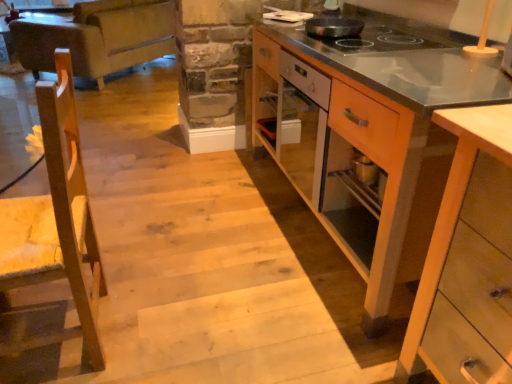
Measure the distance between wooden cabinet at right, which is the 2th cabinetry from front to back, and camera.

wooden cabinet at right, which is the 2th cabinetry from front to back, and camera are 1.02 meters apart.

Where is `light wood cabinet at lower right, the 1th cabinetry in the front-to-back sequence`? The height and width of the screenshot is (384, 512). light wood cabinet at lower right, the 1th cabinetry in the front-to-back sequence is located at coordinates (468, 259).

This screenshot has height=384, width=512. In order to click on leather couch at upper left in this screenshot , I will do `click(98, 37)`.

The width and height of the screenshot is (512, 384). Find the location of `wooden chair at left`. wooden chair at left is located at coordinates (55, 222).

What's the angular difference between wooden chair at left and black non-stick pan at upper center's facing directions?

0.001 degrees.

Which is in front, point (65, 240) or point (342, 23)?

The point (65, 240) is closer.

From a real-world perspective, is wooden chair at left located higher than black non-stick pan at upper center?

Incorrect, from a real-world perspective, wooden chair at left is lower than black non-stick pan at upper center.

Between wooden chair at left and black non-stick pan at upper center, which one is positioned in front?

wooden chair at left is closer to the camera.

Which is more to the left, wooden cabinet at right, which is the 2th cabinetry from front to back, or light wood cabinet at lower right, which ranks as the second cabinetry in back-to-front order?

From the viewer's perspective, wooden cabinet at right, which is the 2th cabinetry from front to back, appears more on the left side.

Can you confirm if wooden cabinet at right, which is the 2th cabinetry from front to back, is shorter than light wood cabinet at lower right, which ranks as the second cabinetry in back-to-front order?

No, wooden cabinet at right, which is the 2th cabinetry from front to back, is not shorter than light wood cabinet at lower right, which ranks as the second cabinetry in back-to-front order.

Does wooden cabinet at right, which is the 2th cabinetry from front to back, have a larger size compared to light wood cabinet at lower right, the 1th cabinetry in the front-to-back sequence?

Yes.

Is wooden cabinet at right, the first cabinetry viewed from the back, oriented away from light wood cabinet at lower right, which ranks as the second cabinetry in back-to-front order?

No, wooden cabinet at right, the first cabinetry viewed from the back, is not facing the opposite direction of light wood cabinet at lower right, which ranks as the second cabinetry in back-to-front order.

Is light wood cabinet at lower right, the 1th cabinetry in the front-to-back sequence, facing away from leather couch at upper left?

No, light wood cabinet at lower right, the 1th cabinetry in the front-to-back sequence, is not facing away from leather couch at upper left.

From the image's perspective, is light wood cabinet at lower right, the 1th cabinetry in the front-to-back sequence, beneath leather couch at upper left?

Correct, light wood cabinet at lower right, the 1th cabinetry in the front-to-back sequence, appears lower than leather couch at upper left in the image.

Considering the sizes of objects light wood cabinet at lower right, which ranks as the second cabinetry in back-to-front order, and leather couch at upper left in the image provided, who is smaller, light wood cabinet at lower right, which ranks as the second cabinetry in back-to-front order, or leather couch at upper left?

With smaller size is light wood cabinet at lower right, which ranks as the second cabinetry in back-to-front order.

From a real-world perspective, who is located lower, light wood cabinet at lower right, the 1th cabinetry in the front-to-back sequence, or leather couch at upper left?

light wood cabinet at lower right, the 1th cabinetry in the front-to-back sequence.

Is point (95, 277) in front of point (428, 280)?

No, (95, 277) is behind (428, 280).

Is wooden chair at left to the left of light wood cabinet at lower right, which ranks as the second cabinetry in back-to-front order, from the viewer's perspective?

Indeed, wooden chair at left is positioned on the left side of light wood cabinet at lower right, which ranks as the second cabinetry in back-to-front order.

Could you tell me if wooden chair at left is facing light wood cabinet at lower right, which ranks as the second cabinetry in back-to-front order?

No, wooden chair at left is not turned towards light wood cabinet at lower right, which ranks as the second cabinetry in back-to-front order.

Consider the image. From a real-world perspective, is wooden chair at left above or below light wood cabinet at lower right, the 1th cabinetry in the front-to-back sequence?

wooden chair at left is above light wood cabinet at lower right, the 1th cabinetry in the front-to-back sequence.

Is black non-stick pan at upper center aimed at leather couch at upper left?

No, black non-stick pan at upper center is not turned towards leather couch at upper left.

Considering the relative sizes of black non-stick pan at upper center and leather couch at upper left in the image provided, is black non-stick pan at upper center taller than leather couch at upper left?

No.

Considering the sizes of black non-stick pan at upper center and leather couch at upper left in the image, is black non-stick pan at upper center wider or thinner than leather couch at upper left?

Considering their sizes, black non-stick pan at upper center looks slimmer than leather couch at upper left.

Are black non-stick pan at upper center and leather couch at upper left far apart?

Yes, black non-stick pan at upper center and leather couch at upper left are located far from each other.

From the image's perspective, does light wood cabinet at lower right, which ranks as the second cabinetry in back-to-front order, appear lower than wooden chair at left?

Correct, light wood cabinet at lower right, which ranks as the second cabinetry in back-to-front order, appears lower than wooden chair at left in the image.

Looking at this image, measure the distance between light wood cabinet at lower right, the 1th cabinetry in the front-to-back sequence, and wooden chair at left.

The distance of light wood cabinet at lower right, the 1th cabinetry in the front-to-back sequence, from wooden chair at left is 1.04 meters.

From a real-world perspective, does light wood cabinet at lower right, which ranks as the second cabinetry in back-to-front order, sit lower than wooden chair at left?

Yes, from a real-world perspective, light wood cabinet at lower right, which ranks as the second cabinetry in back-to-front order, is under wooden chair at left.

Is black non-stick pan at upper center looking in the opposite direction of wooden chair at left?

No, black non-stick pan at upper center is not facing the opposite direction of wooden chair at left.

Is black non-stick pan at upper center to the left of wooden chair at left from the viewer's perspective?

Incorrect, black non-stick pan at upper center is not on the left side of wooden chair at left.

Is black non-stick pan at upper center touching wooden chair at left?

No, black non-stick pan at upper center is not beside wooden chair at left.

In the image, there is a black non-stick pan at upper center. Where is `chair below it (from the image's perspective)`? This screenshot has width=512, height=384. chair below it (from the image's perspective) is located at coordinates (55, 222).

Where is `cabinetry above the light wood cabinet at lower right, which ranks as the second cabinetry in back-to-front order (from a real-world perspective)`? This screenshot has height=384, width=512. cabinetry above the light wood cabinet at lower right, which ranks as the second cabinetry in back-to-front order (from a real-world perspective) is located at coordinates point(381,140).

When comparing their distances from wooden chair at left, does light wood cabinet at lower right, which ranks as the second cabinetry in back-to-front order, or leather couch at upper left seem further?

leather couch at upper left.

When comparing their distances from leather couch at upper left, does wooden cabinet at right, which is the 2th cabinetry from front to back, or wooden chair at left seem closer?

The object closer to leather couch at upper left is wooden cabinet at right, which is the 2th cabinetry from front to back.

From the image, which object appears to be nearer to light wood cabinet at lower right, which ranks as the second cabinetry in back-to-front order, wooden cabinet at right, which is the 2th cabinetry from front to back, or leather couch at upper left?

Among the two, wooden cabinet at right, which is the 2th cabinetry from front to back, is located nearer to light wood cabinet at lower right, which ranks as the second cabinetry in back-to-front order.

Estimate the real-world distances between objects in this image. Which object is further from leather couch at upper left, wooden cabinet at right, which is the 2th cabinetry from front to back, or light wood cabinet at lower right, which ranks as the second cabinetry in back-to-front order?

The object further to leather couch at upper left is light wood cabinet at lower right, which ranks as the second cabinetry in back-to-front order.

Considering their positions, is black non-stick pan at upper center positioned closer to light wood cabinet at lower right, which ranks as the second cabinetry in back-to-front order, than wooden chair at left?

wooden chair at left is positioned closer to the anchor light wood cabinet at lower right, which ranks as the second cabinetry in back-to-front order.

From the image, which object appears to be nearer to leather couch at upper left, black non-stick pan at upper center or wooden cabinet at right, the first cabinetry viewed from the back?

wooden cabinet at right, the first cabinetry viewed from the back, lies closer to leather couch at upper left than the other object.

Based on their spatial positions, is wooden cabinet at right, the first cabinetry viewed from the back, or black non-stick pan at upper center closer to wooden chair at left?

wooden cabinet at right, the first cabinetry viewed from the back, is closer to wooden chair at left.

From the image, which object appears to be farther from wooden cabinet at right, which is the 2th cabinetry from front to back, black non-stick pan at upper center or leather couch at upper left?

leather couch at upper left.

I want to click on cabinetry between wooden chair at left and leather couch at upper left in the front-back direction, so coord(381,140).

This screenshot has width=512, height=384. I want to click on kitchen appliance positioned between wooden chair at left and leather couch at upper left from near to far, so click(x=333, y=27).

The image size is (512, 384). Identify the location of kitchen appliance situated between wooden chair at left and light wood cabinet at lower right, the 1th cabinetry in the front-to-back sequence, from left to right. (333, 27).

Find the location of a particular element. This screenshot has height=384, width=512. kitchen appliance positioned between wooden cabinet at right, the first cabinetry viewed from the back, and leather couch at upper left from near to far is located at coordinates pos(333,27).